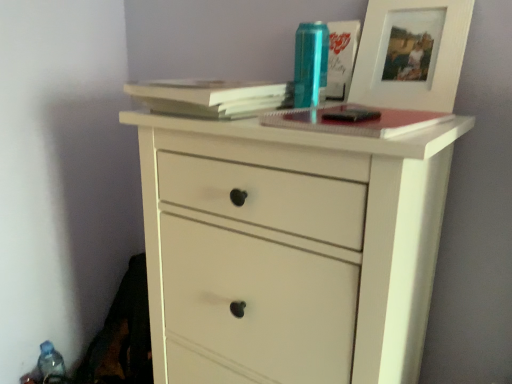
Question: From a real-world perspective, is blue plastic bottle at lower left, positioned as the first bottle in back-to-front order, positioned above or below white wood picture frame at upper right?

Choices:
 (A) below
 (B) above

Answer: (A)

Question: In terms of height, does blue plastic bottle at lower left, the first bottle from the left, look taller or shorter compared to white wood picture frame at upper right?

Choices:
 (A) short
 (B) tall

Answer: (A)

Question: Estimate the real-world distances between objects in this image. Which object is closer to the metallic blue can at upper center, the first bottle positioned from the top?

Choices:
 (A) blue plastic bottle at lower left, the first bottle from the left
 (B) white wood picture frame at upper right
 (C) light brown paper at upper center, positioned as the 2th paperback book in right-to-left order
 (D) white matte chest of drawers at center
 (E) hardcover notebook at center, which ranks as the 2th paperback book in left-to-right order

Answer: (C)

Question: Estimate the real-world distances between objects in this image. Which object is farther from the white matte chest of drawers at center?

Choices:
 (A) hardcover notebook at center, which ranks as the 2th paperback book in left-to-right order
 (B) light brown paper at upper center, positioned as the 1th paperback book in left-to-right order
 (C) metallic blue can at upper center, the first bottle viewed from the right
 (D) white wood picture frame at upper right
 (E) blue plastic bottle at lower left, positioned as the first bottle in back-to-front order

Answer: (E)